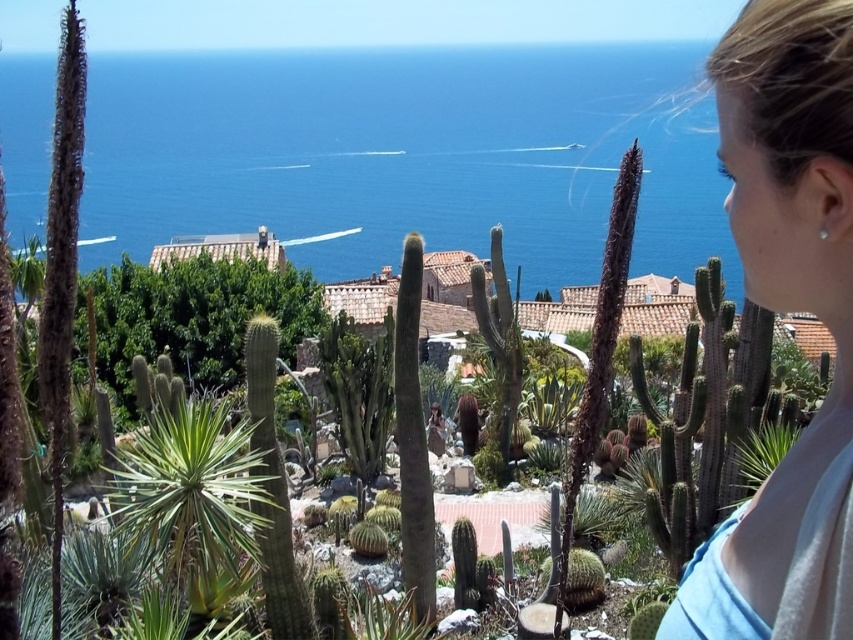
In the scene shown: You are a photographer standing at the coastal landscape scene. You want to capture a photo that includes both the blue water at center and the blonde hair at upper right. Which object should be placed higher in the frame to ensure both are visible?

The blue water at center should be placed higher in the frame because it is taller than the blonde hair at upper right, allowing both to fit within the photo.

You are standing at the coastal landscape and want to take a photo of the blue water at center and the blonde hair at upper right. How far apart are these two elements in the scene?

The blue water at center is 1326.51 feet away from blonde hair at upper right.

You are standing at the point closer to the camera between the two points, point (474,104) and point (799,604). Which point are you standing at?

You are standing at point (474,104) because it is further to the camera than point (799,604).